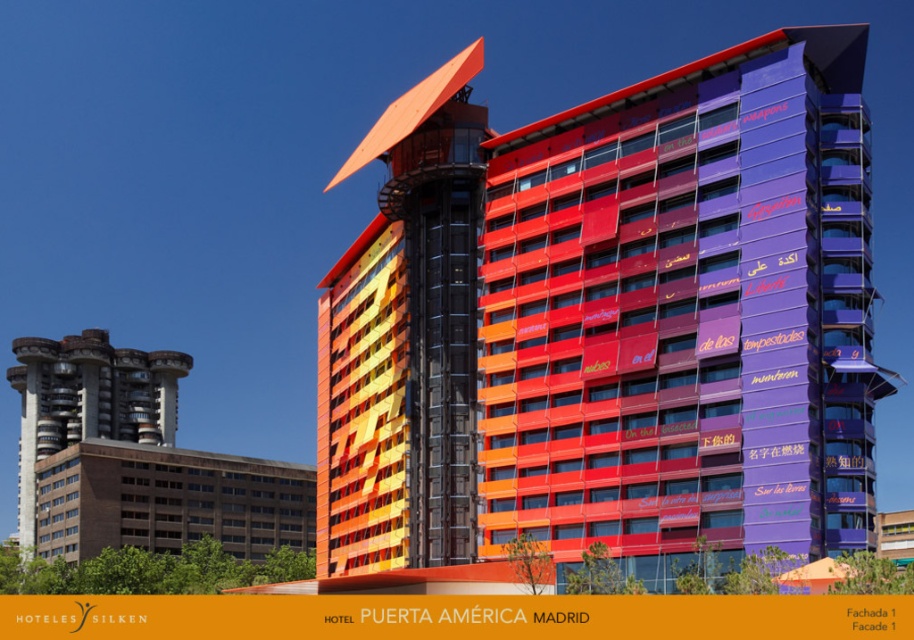
Question: Which object is the closest to the brown brick building at lower left?

Choices:
 (A) multicolored glass elevator at center
 (B) brown concrete building at left
 (C) multicolored glass building at center

Answer: (B)

Question: Can you confirm if multicolored glass elevator at center is positioned to the right of brown brick building at lower left?

Choices:
 (A) yes
 (B) no

Answer: (A)

Question: Can you confirm if multicolored glass elevator at center is positioned to the left of brown concrete building at left?

Choices:
 (A) no
 (B) yes

Answer: (A)

Question: Can you confirm if multicolored glass elevator at center is bigger than brown concrete building at left?

Choices:
 (A) no
 (B) yes

Answer: (A)

Question: Which of these objects is positioned farthest from the multicolored glass building at center?

Choices:
 (A) multicolored glass elevator at center
 (B) brown concrete building at left

Answer: (B)

Question: Which point is farther from the camera taking this photo?

Choices:
 (A) (587, 204)
 (B) (104, 355)
 (C) (317, 477)

Answer: (B)